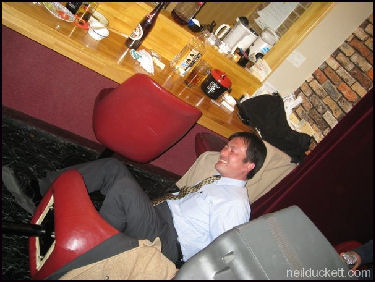
The image size is (375, 282). Find the location of `bar`. bar is located at coordinates (129, 65).